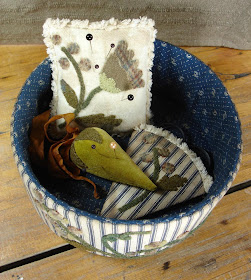
Identify the location of flower applique. Image resolution: width=251 pixels, height=280 pixels. (119, 73).